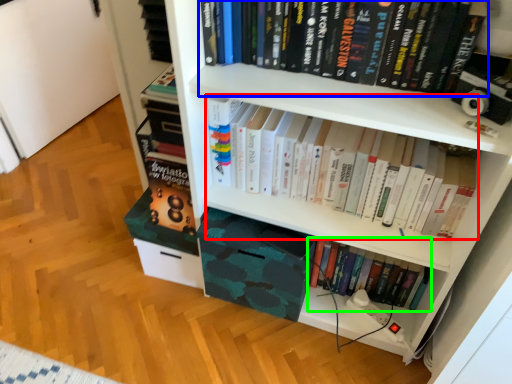
Question: Based on their relative distances, which object is nearer to book (highlighted by a red box)? Choose from book (highlighted by a blue box) and book (highlighted by a green box).

Choices:
 (A) book
 (B) book

Answer: (A)